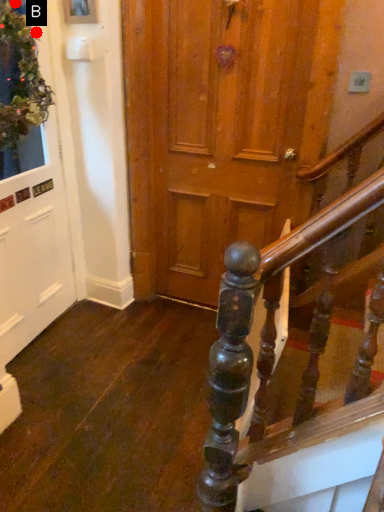
Question: Two points are circled on the image, labeled by A and B beside each circle. Which of the following is the farthest from the observer?

Choices:
 (A) A is further
 (B) B is further

Answer: (B)